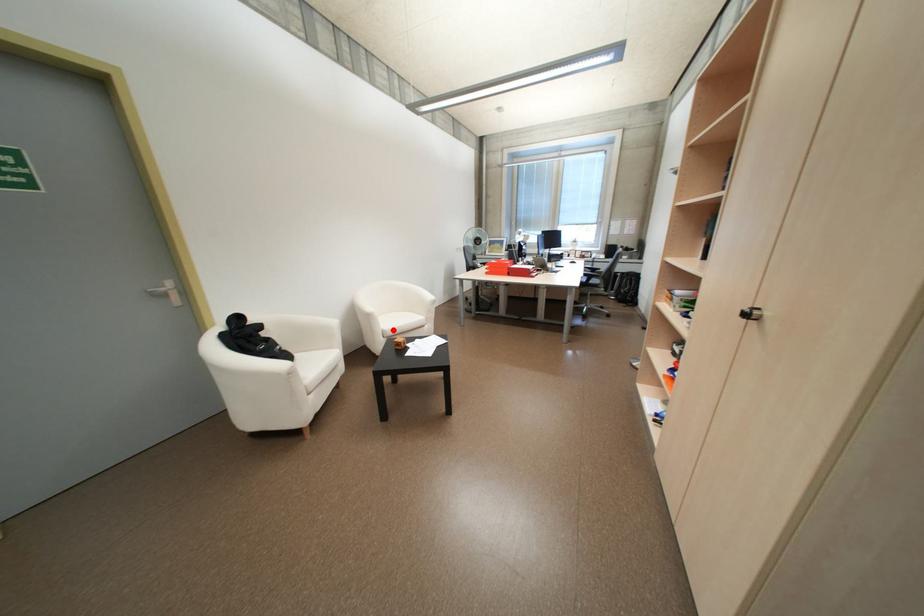
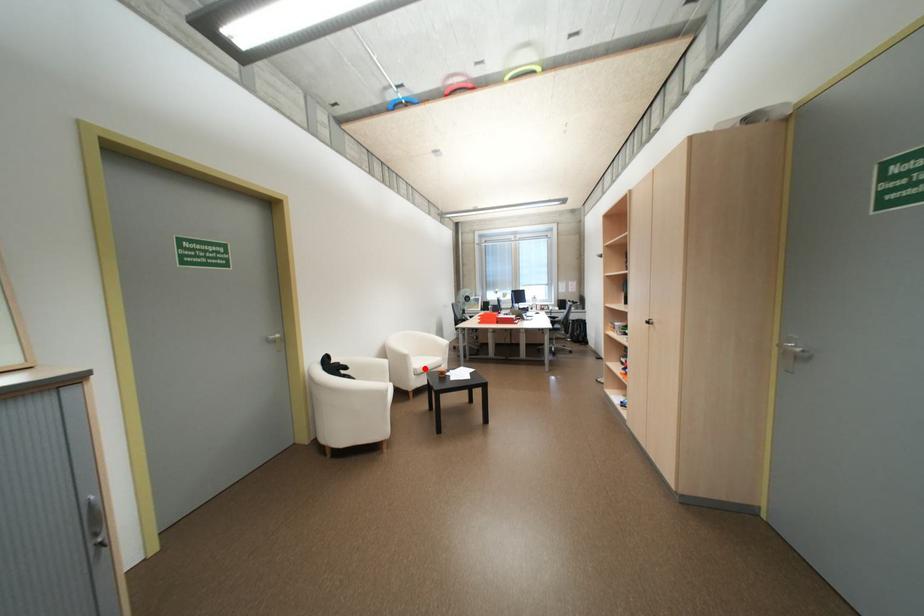
I am providing you with two images of the same scene from different viewpoints. A red point is marked on the first image and another point is marked on the second image. Are the points marked in image1 and image2 representing the same 3D position?

Yes